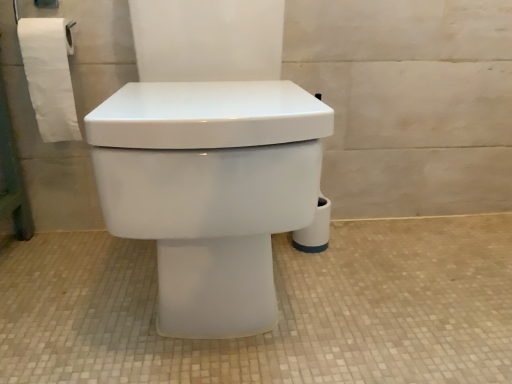
In order to click on white paper at left in this screenshot , I will do `click(50, 76)`.

Describe the element at coordinates (50, 76) in the screenshot. This screenshot has width=512, height=384. I see `white paper at left` at that location.

Measure the distance between point (115, 127) and camera.

Point (115, 127) is 57.40 centimeters away from camera.

Find the location of a particular element. Image resolution: width=512 pixels, height=384 pixels. white glossy toilet at center is located at coordinates (210, 190).

Describe the element at coordinates (210, 190) in the screenshot. I see `white glossy toilet at center` at that location.

You are a GUI agent. You are given a task and a screenshot of the screen. Output one action in this format:
    pyautogui.click(x=<x>, y=<y>)
    Task: Click on the white paper at left
    Image resolution: width=512 pixels, height=384 pixels.
    Given the screenshot: What is the action you would take?
    pyautogui.click(x=50, y=76)

Can you confirm if white paper at left is positioned to the left of white glossy toilet at center?

Correct, you'll find white paper at left to the left of white glossy toilet at center.

In the image, is white paper at left positioned in front of or behind white glossy toilet at center?

white paper at left is positioned farther from the viewer than white glossy toilet at center.

Which is more distant, [31,61] or [202,138]?

Positioned behind is point [31,61].

From the image's perspective, which one is positioned higher, white paper at left or white glossy toilet at center?

white paper at left, from the image's perspective.

From a real-world perspective, does white paper at left sit lower than white glossy toilet at center?

No, from a real-world perspective, white paper at left is not under white glossy toilet at center.

Looking at this image, considering the sizes of objects white paper at left and white glossy toilet at center in the image provided, who is wider, white paper at left or white glossy toilet at center?

white glossy toilet at center is wider.

Looking at this image, considering the relative sizes of white paper at left and white glossy toilet at center in the image provided, is white paper at left shorter than white glossy toilet at center?

Correct, white paper at left is not as tall as white glossy toilet at center.

Which of these two, white paper at left or white glossy toilet at center, is smaller?

white paper at left is smaller.

Is white paper at left not inside white glossy toilet at center?

Absolutely, white paper at left is external to white glossy toilet at center.

Is white paper at left far away from white glossy toilet at center?

No, white paper at left is not far away from white glossy toilet at center.

Is white glossy toilet at center at the back of white paper at left?

That's not correct — white paper at left is not looking away from white glossy toilet at center.

Can you tell me how much white paper at left and white glossy toilet at center differ in facing direction?

white paper at left and white glossy toilet at center are facing 0.772 degrees away from each other.

How distant is white paper at left from white glossy toilet at center?

white paper at left is 20.93 inches away from white glossy toilet at center.

The width and height of the screenshot is (512, 384). What are the coordinates of `toilet below the white paper at left (from a real-world perspective)` in the screenshot? It's located at (210, 190).

Which is more to the right, white glossy toilet at center or white paper at left?

white glossy toilet at center.

Considering the positions of objects white glossy toilet at center and white paper at left in the image provided, who is in front, white glossy toilet at center or white paper at left?

Positioned in front is white glossy toilet at center.

Between point (183, 172) and point (66, 21), which one is positioned in front?

The point (183, 172) is closer to the camera.

From the image's perspective, is white glossy toilet at center over white paper at left?

No, from the image's perspective, white glossy toilet at center is not on top of white paper at left.

From a real-world perspective, is white glossy toilet at center located beneath white paper at left?

Yes, from a real-world perspective, white glossy toilet at center is under white paper at left.

Considering the sizes of objects white glossy toilet at center and white paper at left in the image provided, who is wider, white glossy toilet at center or white paper at left?

Wider between the two is white glossy toilet at center.

Considering the relative sizes of white glossy toilet at center and white paper at left in the image provided, is white glossy toilet at center shorter than white paper at left?

In fact, white glossy toilet at center may be taller than white paper at left.

From the picture: Is white glossy toilet at center smaller than white paper at left?

Incorrect, white glossy toilet at center is not smaller in size than white paper at left.

Can white paper at left be found inside white glossy toilet at center?

No, white paper at left is not surrounded by white glossy toilet at center.

Is white glossy toilet at center beside white paper at left?

white glossy toilet at center and white paper at left are not in contact.

Consider the image. Is white glossy toilet at center turned away from white paper at left?

No, white paper at left is not at the back of white glossy toilet at center.

Looking at this image, how distant is white glossy toilet at center from white paper at left?

The distance of white glossy toilet at center from white paper at left is 20.93 inches.

Find the location of a particular element. Image resolution: width=512 pixels, height=384 pixels. toilet beneath the white paper at left (from a real-world perspective) is located at coordinates (210, 190).

The image size is (512, 384). Find the location of `toilet paper that appears on the left of white glossy toilet at center`. toilet paper that appears on the left of white glossy toilet at center is located at coordinates (50, 76).

Find the location of a particular element. toilet paper that appears above the white glossy toilet at center (from a real-world perspective) is located at coordinates (50, 76).